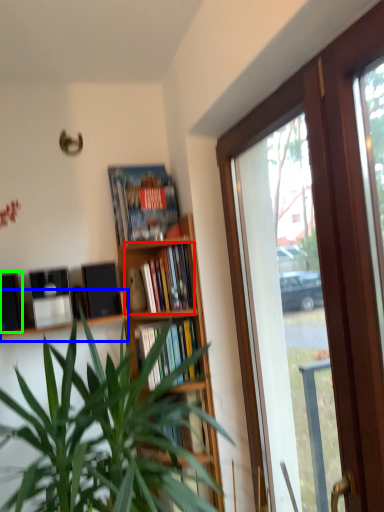
Question: Which object is positioned farthest from book (highlighted by a red box)? Select from shelf (highlighted by a blue box) and loudspeaker (highlighted by a green box).

Choices:
 (A) shelf
 (B) loudspeaker

Answer: (B)